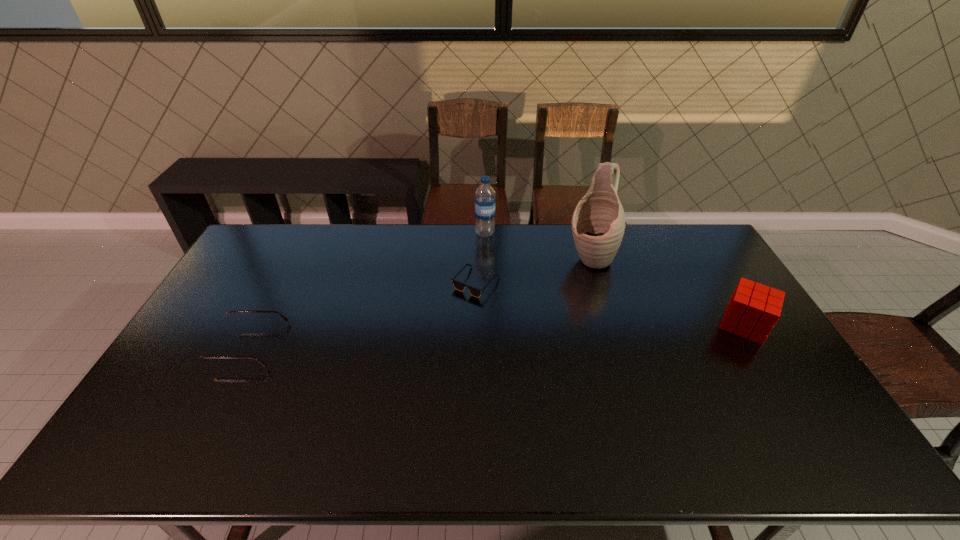
The image size is (960, 540). I want to click on vacant space located at the hinge ends of the spectacles, so click(x=201, y=345).

Where is `vacant space located at the hinge ends of the spectacles`? The width and height of the screenshot is (960, 540). vacant space located at the hinge ends of the spectacles is located at coordinates (194, 345).

You are a GUI agent. You are given a task and a screenshot of the screen. Output one action in this format:
    pyautogui.click(x=<x>, y=<y>)
    Task: Click on the free spot located 0.200m on the back of the rightmost object
    
    Given the screenshot: What is the action you would take?
    pyautogui.click(x=708, y=266)

This screenshot has width=960, height=540. Find the location of `vacant space situated at the spout of the pitcher`. vacant space situated at the spout of the pitcher is located at coordinates (539, 354).

This screenshot has width=960, height=540. I want to click on vacant region located at the spout of the pitcher, so click(x=562, y=312).

The height and width of the screenshot is (540, 960). Identify the location of vacant area located at the spout of the pitcher. (577, 285).

The height and width of the screenshot is (540, 960). What are the coordinates of `free region located on the lenses of the sunglasses` in the screenshot? It's located at (468, 388).

Identify the location of vacant space located 0.120m on the lenses of the sunglasses. This screenshot has height=540, width=960. (473, 327).

Identify the location of vacant area situated on the lenses of the sunglasses. click(469, 382).

What are the coordinates of `vacant space located on the label of the fourth shortest object` in the screenshot? It's located at (486, 257).